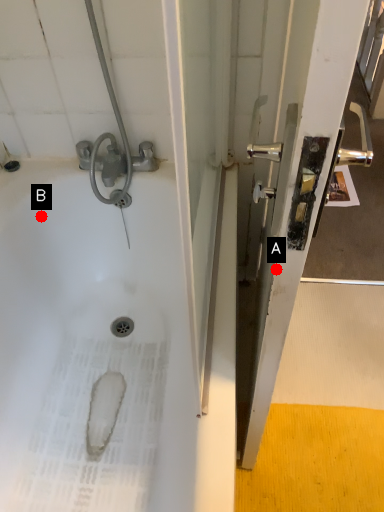
Question: Two points are circled on the image, labeled by A and B beside each circle. Which point is closer to the camera taking this photo?

Choices:
 (A) A is closer
 (B) B is closer

Answer: (A)